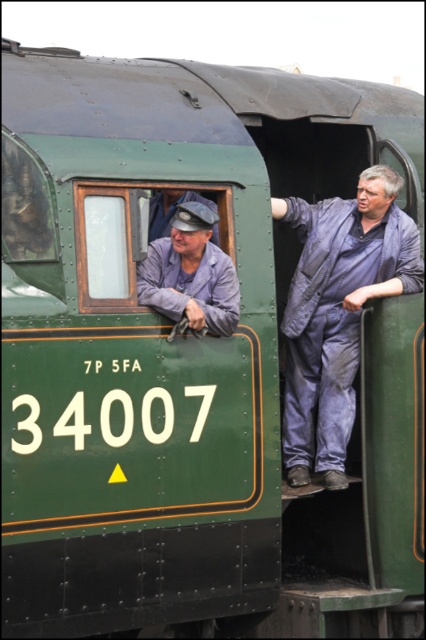
Question: Which object is positioned closest to the blue denim jumpsuit at right?

Choices:
 (A) matte blue uniform at center
 (B) denim cap at left

Answer: (A)

Question: Which point is farther to the camera?

Choices:
 (A) blue denim jumpsuit at right
 (B) denim cap at left

Answer: (A)

Question: Is matte blue uniform at center wider than denim cap at left?

Choices:
 (A) no
 (B) yes

Answer: (B)

Question: Which of the following is the farthest from the observer?

Choices:
 (A) matte blue uniform at center
 (B) denim cap at left
 (C) blue denim jumpsuit at right

Answer: (C)

Question: Is blue denim jumpsuit at right above denim cap at left?

Choices:
 (A) no
 (B) yes

Answer: (A)

Question: Does blue denim jumpsuit at right appear under matte blue uniform at center?

Choices:
 (A) yes
 (B) no

Answer: (A)